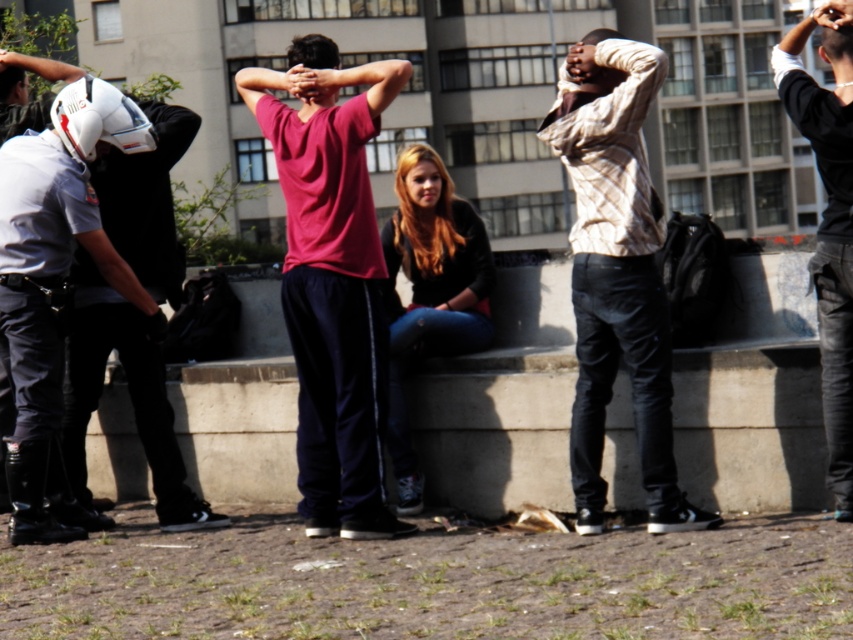
Question: Considering the relative positions of white matte helmet at left and dark brown leather jacket at center in the image provided, where is white matte helmet at left located with respect to dark brown leather jacket at center?

Choices:
 (A) right
 (B) left

Answer: (B)

Question: Which point is closer to the camera?

Choices:
 (A) white matte helmet at left
 (B) dark brown leather jacket at center

Answer: (B)

Question: Does light brown plaid shirt at center appear on the right side of black leather jacket at right?

Choices:
 (A) yes
 (B) no

Answer: (B)

Question: Among these points, which one is farthest from the camera?

Choices:
 (A) (589, 360)
 (B) (828, 307)
 (C) (12, 339)

Answer: (C)

Question: Where is white matte helmet at left located in relation to dark brown leather jacket at center in the image?

Choices:
 (A) left
 (B) right

Answer: (A)

Question: Among these objects, which one is farthest from the camera?

Choices:
 (A) white matte helmet at left
 (B) dark brown leather jacket at center
 (C) light brown plaid shirt at center

Answer: (A)